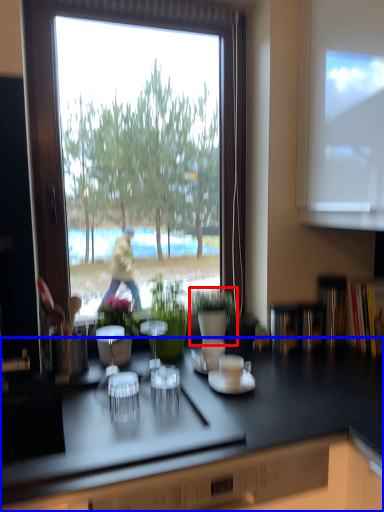
Question: Which point is further to the camera, houseplant (highlighted by a red box) or countertop (highlighted by a blue box)?

Choices:
 (A) houseplant
 (B) countertop

Answer: (A)